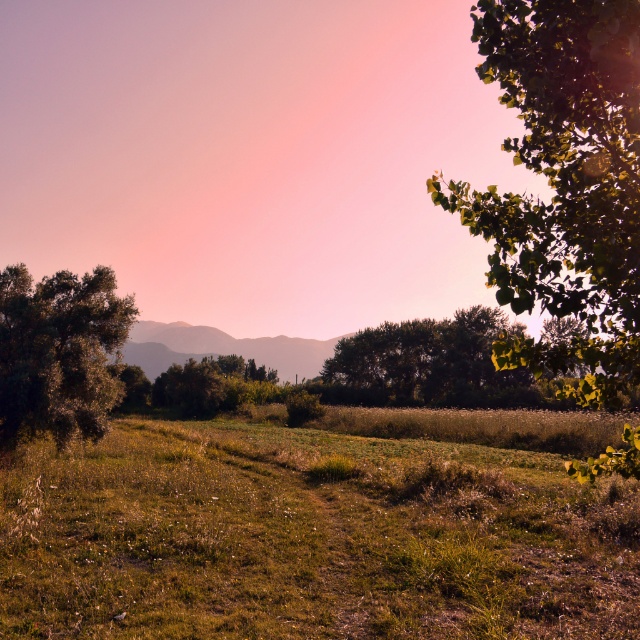
Question: Can you confirm if green grassy field at center is thinner than green leafy tree at right?

Choices:
 (A) no
 (B) yes

Answer: (B)

Question: Among these points, which one is nearest to the camera?

Choices:
 (A) (605, 150)
 (B) (388, 369)

Answer: (A)

Question: Can you confirm if green grassy field at center is positioned to the left of green leafy tree at left?

Choices:
 (A) yes
 (B) no

Answer: (B)

Question: Which object is closer to the camera taking this photo?

Choices:
 (A) green leafy tree at center
 (B) green leafy tree at left
 (C) green leafy tree at right
 (D) rustic brown hillside at center

Answer: (C)

Question: From the image, what is the correct spatial relationship of green leafy tree at left in relation to green leafy tree at center?

Choices:
 (A) left
 (B) right

Answer: (A)

Question: Which object appears closest to the camera in this image?

Choices:
 (A) green leafy tree at right
 (B) green leafy tree at left

Answer: (A)